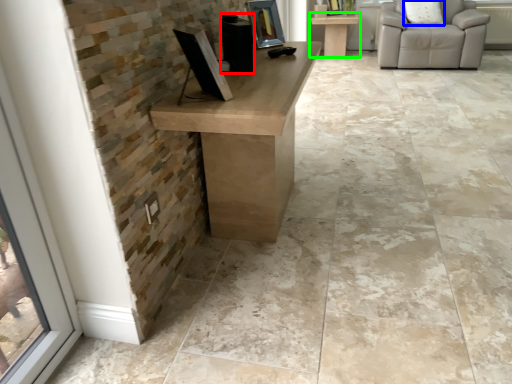
Question: Which object is the farthest from speaker (highlighted by a red box)? Choose among these: pillow (highlighted by a blue box) or table (highlighted by a green box).

Choices:
 (A) pillow
 (B) table

Answer: (B)